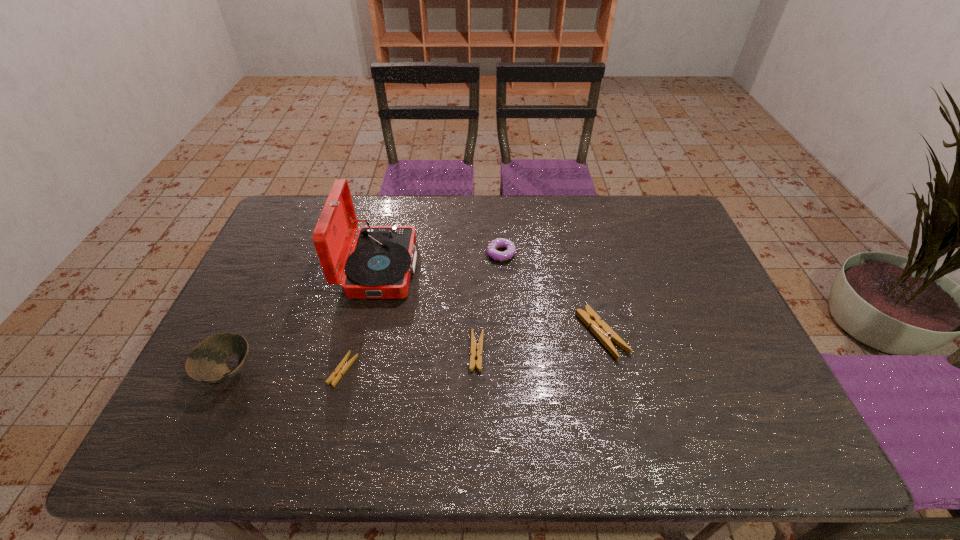
What are the coordinates of `the leftmost object` in the screenshot? It's located at (206, 363).

Image resolution: width=960 pixels, height=540 pixels. Find the location of `vacant space located on the left of the leftmost clothespin`. vacant space located on the left of the leftmost clothespin is located at coordinates (245, 370).

Where is `blank space located on the right of the second clothespin from left to right`? The height and width of the screenshot is (540, 960). blank space located on the right of the second clothespin from left to right is located at coordinates point(605,352).

Find the location of a particular element. Image resolution: width=960 pixels, height=540 pixels. free space located 0.060m on the back of the rightmost object is located at coordinates pyautogui.click(x=591, y=293).

Locate an element on the screen. This screenshot has height=540, width=960. blank space located on the left of the fourth shortest object is located at coordinates (395, 254).

This screenshot has width=960, height=540. In order to click on blank area located 0.080m on the front-facing side of the tallest object in this screenshot , I will do `click(443, 268)`.

You are a GUI agent. You are given a task and a screenshot of the screen. Output one action in this format:
    pyautogui.click(x=<x>, y=<y>)
    Task: Click on the vacant region located on the right of the leftmost object
    The width and height of the screenshot is (960, 540).
    Given the screenshot: What is the action you would take?
    pyautogui.click(x=378, y=372)

You are a GUI agent. You are given a task and a screenshot of the screen. Output one action in this format:
    pyautogui.click(x=<x>, y=<y>)
    Task: Click on the clothespin situated at the near edge
    This screenshot has width=960, height=540.
    Given the screenshot: What is the action you would take?
    pyautogui.click(x=343, y=366)

The image size is (960, 540). Find the location of `bowl that is at the near edge`. bowl that is at the near edge is located at coordinates (206, 363).

I want to click on object at the left edge, so click(206, 363).